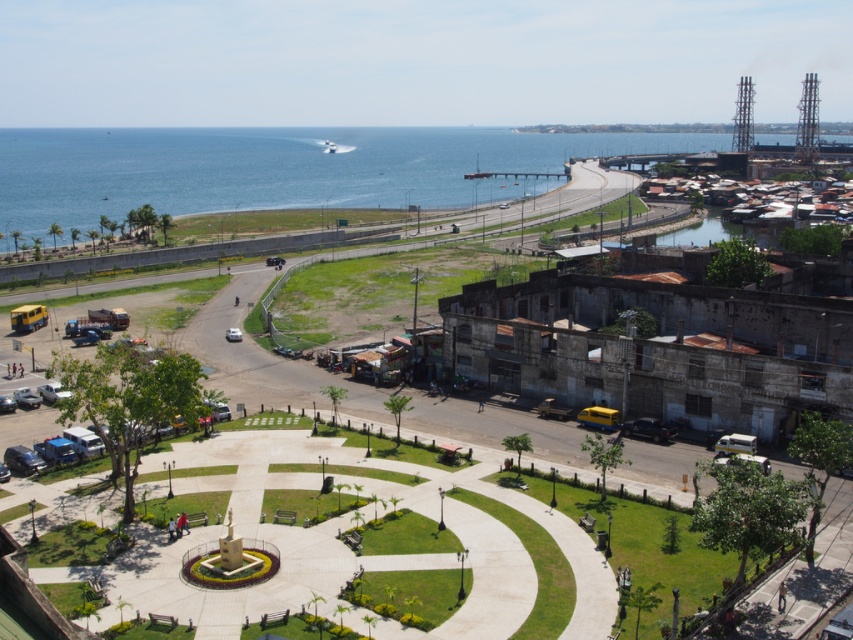
Question: Is blue water at lower left positioned at the back of white matte car at center?

Choices:
 (A) no
 (B) yes

Answer: (B)

Question: Does blue water at lower left have a larger size compared to white matte car at center?

Choices:
 (A) no
 (B) yes

Answer: (B)

Question: Among these objects, which one is nearest to the camera?

Choices:
 (A) blue water at lower left
 (B) white matte car at center

Answer: (B)

Question: Does blue water at lower left lie behind white matte car at center?

Choices:
 (A) yes
 (B) no

Answer: (A)

Question: Which point is farther to the camera?

Choices:
 (A) (228, 339)
 (B) (167, 195)

Answer: (B)

Question: Among these objects, which one is nearest to the camera?

Choices:
 (A) blue water at lower left
 (B) white matte car at center

Answer: (B)